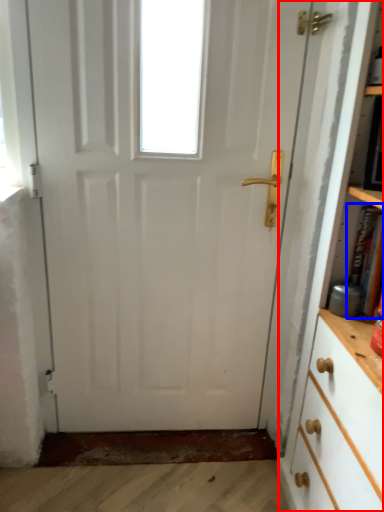
Question: Which object is closer to the camera taking this photo, bookcase (highlighted by a red box) or book (highlighted by a blue box)?

Choices:
 (A) bookcase
 (B) book

Answer: (A)